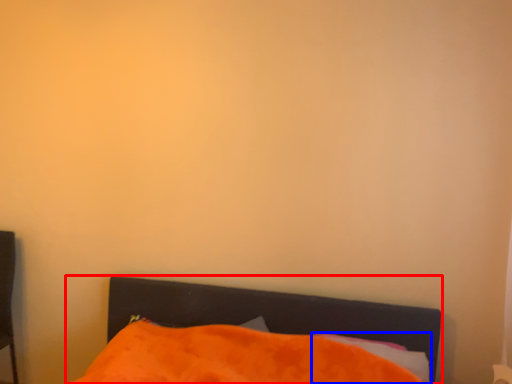
Question: Among these objects, which one is nearest to the camera, bed (highlighted by a red box) or pillow (highlighted by a blue box)?

Choices:
 (A) bed
 (B) pillow

Answer: (A)